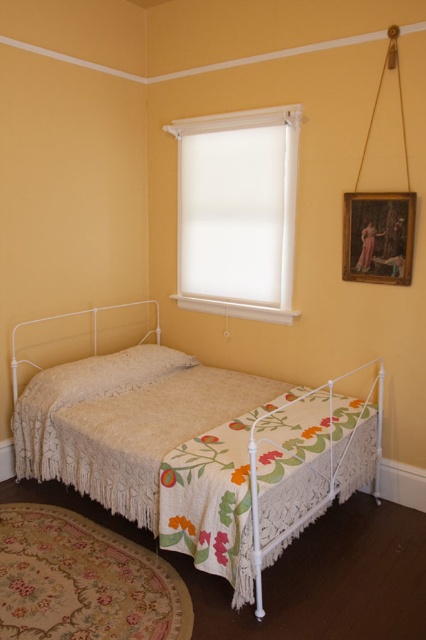
Who is positioned more to the left, white lace bed at center or white matte window at upper center?

Positioned to the left is white lace bed at center.

Does white lace bed at center have a lesser height compared to white matte window at upper center?

Correct, white lace bed at center is not as tall as white matte window at upper center.

Between point (167, 472) and point (207, 212), which one is positioned in front?

Positioned in front is point (167, 472).

Image resolution: width=426 pixels, height=640 pixels. Identify the location of white lace bed at center. (207, 465).

Between white lace bed at center and wooden framed painting at upper right, which one has more height?

With more height is white lace bed at center.

Between white lace bed at center and wooden framed painting at upper right, which one appears on the right side from the viewer's perspective?

Positioned to the right is wooden framed painting at upper right.

Does point (74, 444) lie behind point (357, 202)?

That is False.

In order to click on white lace bed at center in this screenshot , I will do pyautogui.click(x=207, y=465).

Does point (232, 138) lie in front of point (365, 244)?

No, (232, 138) is further to viewer.

Is point (284, 202) positioned after point (374, 282)?

Yes, point (284, 202) is behind point (374, 282).

Identify the location of white matte window at upper center. The image size is (426, 640). (238, 211).

The height and width of the screenshot is (640, 426). Find the location of `white matte window at upper center`. white matte window at upper center is located at coordinates pos(238,211).